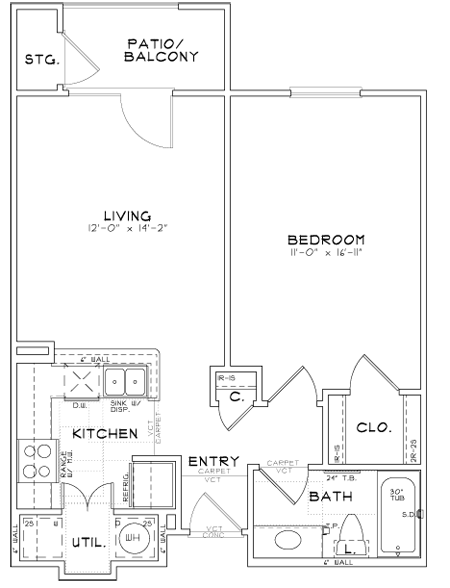
Locate an element on the screen. Image resolution: width=450 pixels, height=588 pixels. refrigerator is located at coordinates (150, 479).